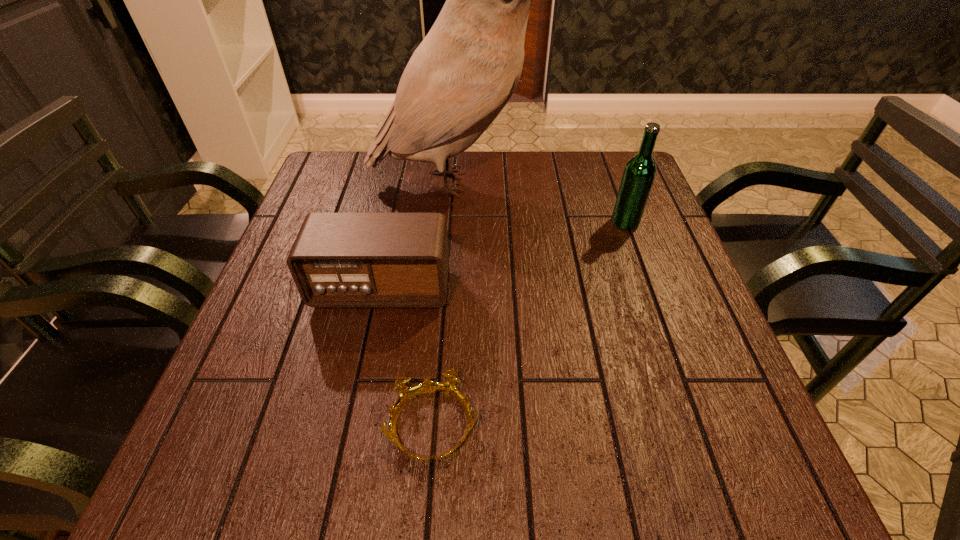
At what (x,y) coordinates should I click in order to perform the action: click on free space between the third shortest object and the nearest object. Please return your answer as a coordinate pair (x, y). The height and width of the screenshot is (540, 960). Looking at the image, I should click on (529, 324).

Locate an element on the screen. free area in between the third farthest object and the third shortest object is located at coordinates (503, 255).

Select which object appears as the closest to the shortest object. Please provide its 2D coordinates. Your answer should be formatted as a tuple, i.e. [(x, y)], where the tuple contains the x and y coordinates of a point satisfying the conditions above.

[(338, 260)]

At what (x,y) coordinates should I click in order to perform the action: click on object that stands as the third closest to the rightmost object. Please return your answer as a coordinate pair (x, y). This screenshot has height=540, width=960. Looking at the image, I should click on (406, 393).

Where is `vacant point that satisfies the following two spatial constraints: 1. on the face of the parakeet; 2. on the front-facing side of the second nearest object`? vacant point that satisfies the following two spatial constraints: 1. on the face of the parakeet; 2. on the front-facing side of the second nearest object is located at coordinates (445, 288).

Locate an element on the screen. free space that satisfies the following two spatial constraints: 1. on the back side of the third shortest object; 2. on the right side of the crown is located at coordinates (449, 222).

Locate an element on the screen. The image size is (960, 540). free spot that satisfies the following two spatial constraints: 1. on the face of the tallest object; 2. on the right side of the rightmost object is located at coordinates (450, 222).

The image size is (960, 540). I want to click on free location that satisfies the following two spatial constraints: 1. on the face of the parakeet; 2. on the front-facing side of the third farthest object, so click(445, 288).

In order to click on free space that satisfies the following two spatial constraints: 1. on the face of the tallest object; 2. on the back side of the beer bottle in this screenshot , I will do `click(450, 222)`.

At what (x,y) coordinates should I click in order to perform the action: click on vacant space that satisfies the following two spatial constraints: 1. on the face of the parakeet; 2. on the left side of the second farthest object. Please return your answer as a coordinate pair (x, y). Looking at the image, I should click on (450, 222).